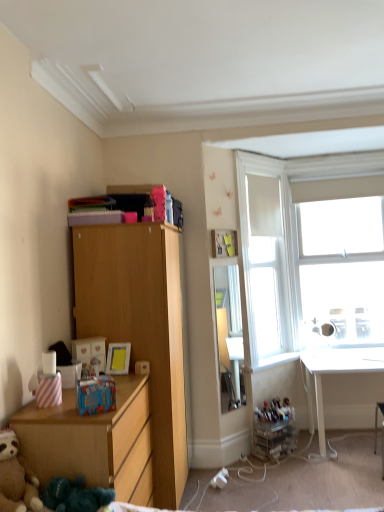
Question: Is white glass window at upper right further to camera compared to white glossy window sill at lower right?

Choices:
 (A) yes
 (B) no

Answer: (A)

Question: Can you confirm if white glass window at upper right is bigger than white glossy window sill at lower right?

Choices:
 (A) no
 (B) yes

Answer: (B)

Question: Is the depth of white glass window at upper right less than that of white glossy window sill at lower right?

Choices:
 (A) yes
 (B) no

Answer: (B)

Question: From a real-world perspective, does white glass window at upper right stand above white glossy window sill at lower right?

Choices:
 (A) yes
 (B) no

Answer: (A)

Question: Is white glass window at upper right far from white glossy window sill at lower right?

Choices:
 (A) no
 (B) yes

Answer: (A)

Question: Does white glass window at upper right appear on the right side of white glossy window sill at lower right?

Choices:
 (A) no
 (B) yes

Answer: (B)

Question: Can you confirm if light wood cabinet at left is positioned to the right of white glass window at upper right?

Choices:
 (A) no
 (B) yes

Answer: (A)

Question: Is light wood cabinet at left shorter than white glass window at upper right?

Choices:
 (A) yes
 (B) no

Answer: (B)

Question: Could you tell me if light wood cabinet at left is turned towards white glass window at upper right?

Choices:
 (A) yes
 (B) no

Answer: (B)

Question: From the image's perspective, is light wood cabinet at left on white glass window at upper right?

Choices:
 (A) no
 (B) yes

Answer: (A)

Question: From the image's perspective, does light wood cabinet at left appear lower than white glass window at upper right?

Choices:
 (A) yes
 (B) no

Answer: (A)

Question: Is light wood cabinet at left not close to white glass window at upper right?

Choices:
 (A) yes
 (B) no

Answer: (A)

Question: Is brown plush teddy bear at lower left located within white glossy window sill at lower right?

Choices:
 (A) no
 (B) yes

Answer: (A)